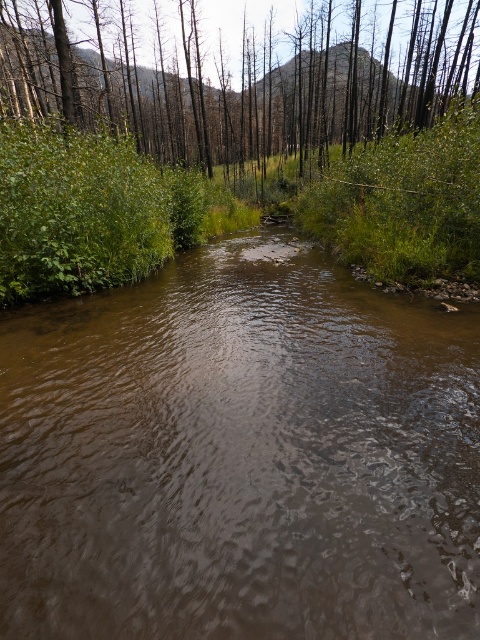
Based on the photo, can you confirm if brown smooth stream at center is shorter than green matte tree at upper center?

Indeed, brown smooth stream at center has a lesser height compared to green matte tree at upper center.

Does brown smooth stream at center appear on the right side of green matte tree at upper center?

Yes, brown smooth stream at center is to the right of green matte tree at upper center.

Where is `brown smooth stream at center`? This screenshot has width=480, height=640. brown smooth stream at center is located at coordinates (240, 458).